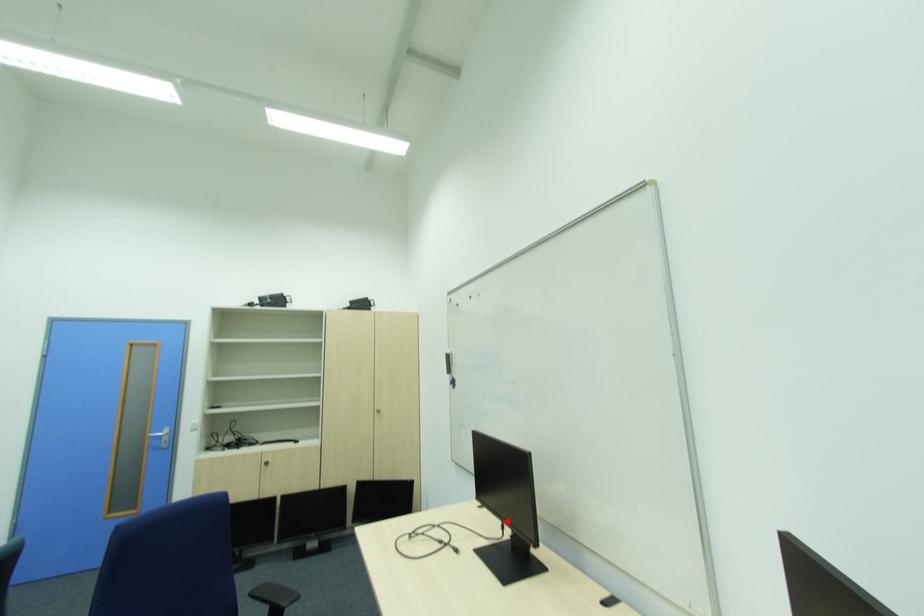
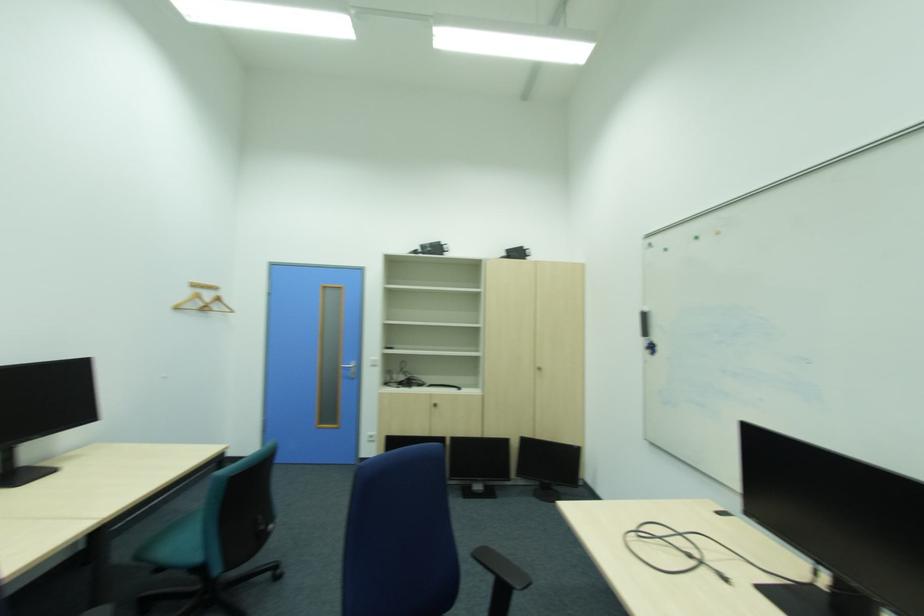
Where in the second image is the point corresponding to the highlighted location from the first image?

(815, 561)